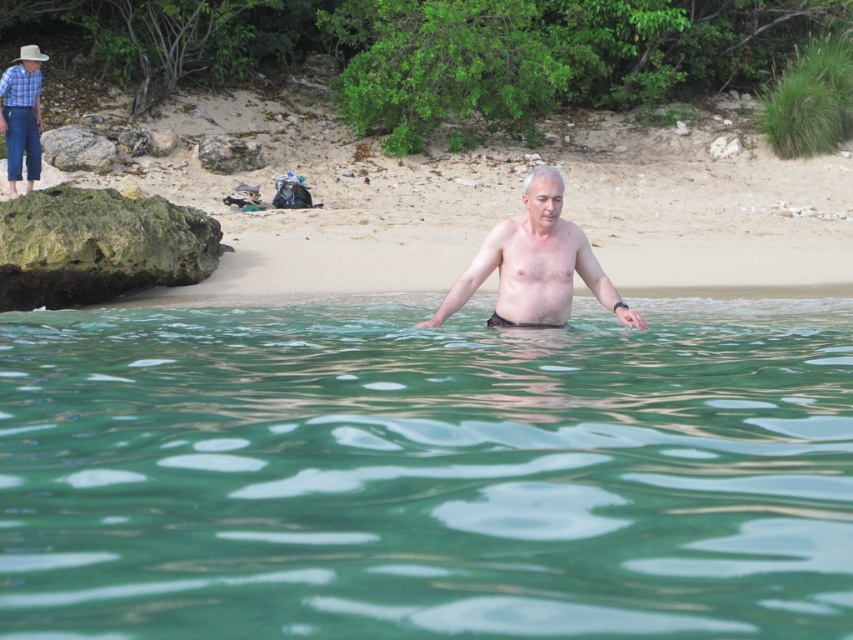
In the scene shown: Can you confirm if skinny black shorts at center is wider than checkered fabric shirt at upper left?

Yes, skinny black shorts at center is wider than checkered fabric shirt at upper left.

Find the location of a particular element. skinny black shorts at center is located at coordinates (535, 264).

Can you confirm if sandy beach at center is positioned to the right of skinny black shorts at center?

No, sandy beach at center is not to the right of skinny black shorts at center.

Is point (291, 292) more distant than point (534, 211)?

Yes, point (291, 292) is behind point (534, 211).

The width and height of the screenshot is (853, 640). Describe the element at coordinates (341, 216) in the screenshot. I see `sandy beach at center` at that location.

Where is `sandy beach at center`? Image resolution: width=853 pixels, height=640 pixels. sandy beach at center is located at coordinates (341, 216).

Is point (28, 416) less distant than point (515, 282)?

Yes.

Who is positioned more to the right, green translucent water at center or skinny black shorts at center?

skinny black shorts at center

Between point (807, 323) and point (456, 292), which one is positioned behind?

Point (807, 323)

I want to click on green translucent water at center, so click(x=426, y=472).